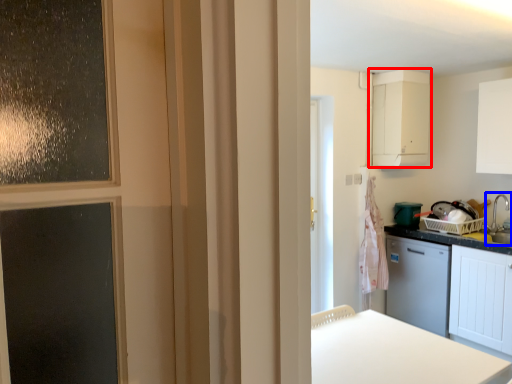
Question: Among these objects, which one is nearest to the camera, cabinetry (highlighted by a red box) or sink (highlighted by a blue box)?

Choices:
 (A) cabinetry
 (B) sink

Answer: (B)